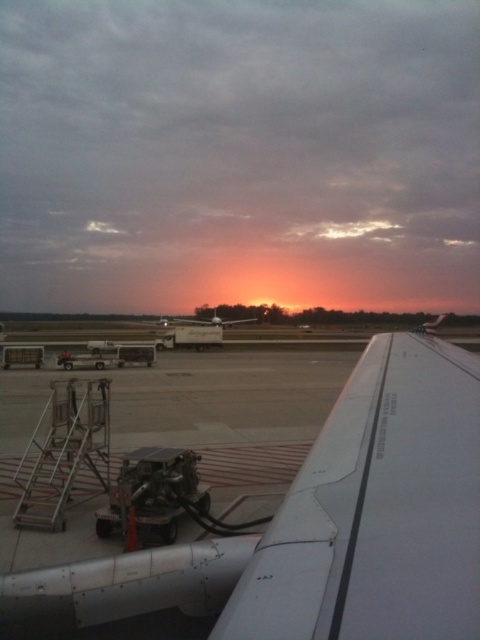
Question: Based on their relative distances, which object is farther from the white matte wing at upper right?

Choices:
 (A) metallic silver ladder at lower left
 (B) white matte airplane at center

Answer: (B)

Question: Does metallic silver ladder at lower left have a larger size compared to white matte airplane at center?

Choices:
 (A) no
 (B) yes

Answer: (A)

Question: Which point is farther to the camera?

Choices:
 (A) (447, 413)
 (B) (19, 474)
 (C) (182, 321)

Answer: (C)

Question: Which of the following is the farthest from the observer?

Choices:
 (A) white matte airplane at center
 (B) white matte wing at upper right

Answer: (A)

Question: Can you confirm if white matte wing at upper right is positioned below metallic silver ladder at lower left?

Choices:
 (A) no
 (B) yes

Answer: (A)

Question: Is white matte wing at upper right smaller than metallic silver ladder at lower left?

Choices:
 (A) no
 (B) yes

Answer: (B)